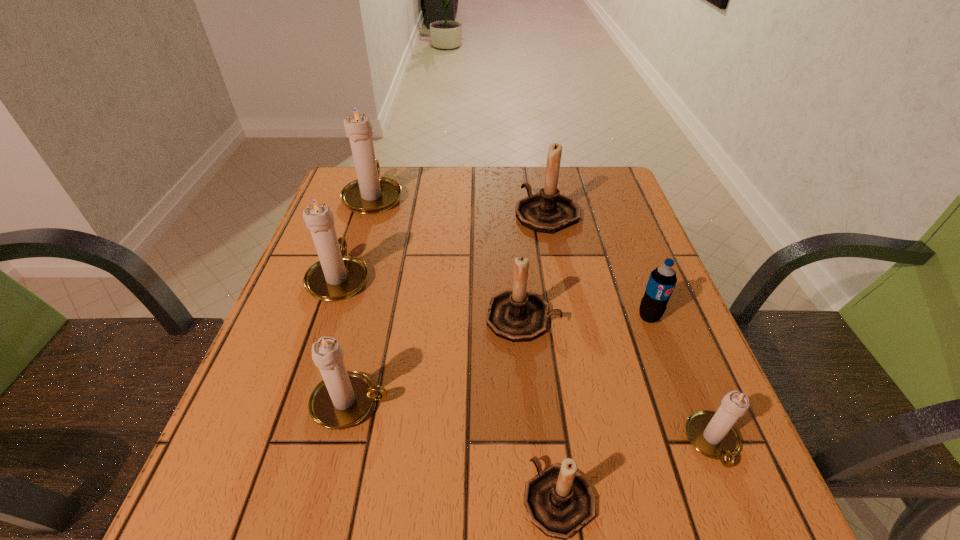
The width and height of the screenshot is (960, 540). Find the location of `free space between the second smallest white candle holder and the biggest white candle holder`. free space between the second smallest white candle holder and the biggest white candle holder is located at coordinates (362, 299).

In order to click on free space that is in between the second smallest brown candle holder and the second biggest white candle holder in this screenshot , I will do `click(431, 297)`.

This screenshot has width=960, height=540. What are the coordinates of `vacant area that lies between the tallest candle holder and the second biggest white candle holder` in the screenshot? It's located at (356, 236).

At what (x,y) coordinates should I click in order to perform the action: click on vacant area that lies between the second farthest brown candle holder and the soda bottle. Please return your answer as a coordinate pair (x, y). Image resolution: width=960 pixels, height=540 pixels. Looking at the image, I should click on (586, 317).

Locate which object ranks sixth in proximity to the tallest candle holder. Please provide its 2D coordinates. Your answer should be formatted as a tuple, i.e. [(x, y)], where the tuple contains the x and y coordinates of a point satisfying the conditions above.

[(559, 501)]

Where is `object that stands as the fourth closest to the second farthest white candle holder`? This screenshot has height=540, width=960. object that stands as the fourth closest to the second farthest white candle holder is located at coordinates (548, 211).

Locate an element on the screen. Image resolution: width=960 pixels, height=540 pixels. candle holder identified as the second closest to the second biggest brown candle holder is located at coordinates (548, 211).

Choose which candle holder is the seventh nearest neighbor to the soda bottle. Please provide its 2D coordinates. Your answer should be formatted as a tuple, i.e. [(x, y)], where the tuple contains the x and y coordinates of a point satisfying the conditions above.

[(370, 194)]

Where is `the third closest white candle holder relative to the second biggest brown candle holder`? The image size is (960, 540). the third closest white candle holder relative to the second biggest brown candle holder is located at coordinates (336, 276).

At what (x,y) coordinates should I click in order to perform the action: click on the closest white candle holder relative to the second smallest brown candle holder. Please return your answer as a coordinate pair (x, y). This screenshot has width=960, height=540. Looking at the image, I should click on (343, 398).